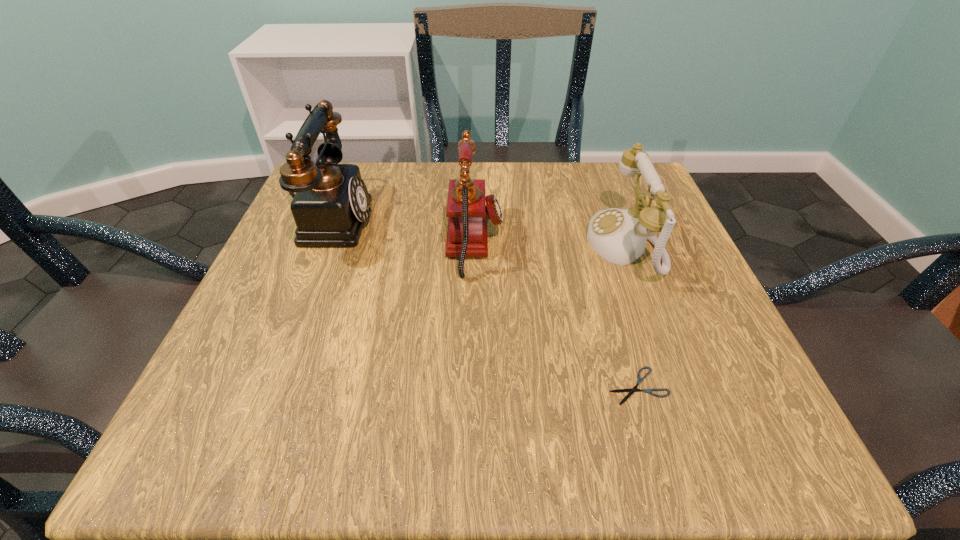
Find the location of `free region at the near edge of the desktop`. free region at the near edge of the desktop is located at coordinates (488, 403).

Find the location of a particular element. Image resolution: width=960 pixels, height=540 pixels. vacant space at the left edge is located at coordinates (321, 308).

Where is `vacant space at the right edge`? vacant space at the right edge is located at coordinates [x=661, y=300].

This screenshot has height=540, width=960. Identify the location of blank space at the far right corner of the desktop. coord(618,184).

Find the location of `vacant area between the second telephone from right to left and the rightmost telephone`. vacant area between the second telephone from right to left and the rightmost telephone is located at coordinates (550, 243).

In order to click on blank region between the tallest telephone and the second telephone from left to right in this screenshot , I will do `click(402, 231)`.

This screenshot has height=540, width=960. I want to click on empty space between the third object from right to left and the tallest telephone, so click(402, 231).

Locate an element on the screen. This screenshot has height=540, width=960. vacant space in between the shortest object and the tallest object is located at coordinates (484, 302).

Locate an element on the screen. This screenshot has height=540, width=960. empty location between the shears and the rightmost telephone is located at coordinates click(631, 315).

You are a GUI agent. You are given a task and a screenshot of the screen. Output one action in this format:
    pyautogui.click(x=<x>, y=<y>)
    Task: Click on the vacant point located between the tallest object and the shears
    This screenshot has height=540, width=960.
    Given the screenshot: What is the action you would take?
    pyautogui.click(x=484, y=302)